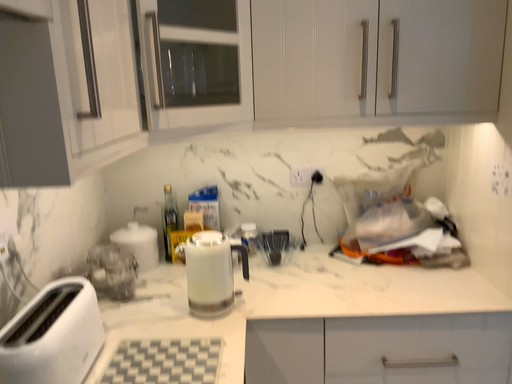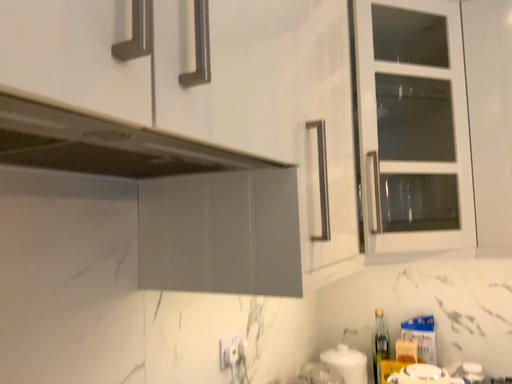
Question: Which way did the camera rotate in the video?

Choices:
 (A) rotated downward
 (B) rotated upward

Answer: (B)